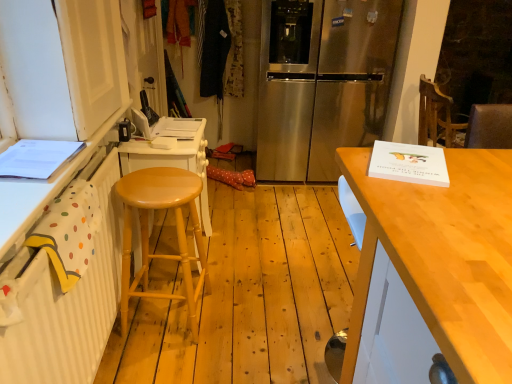
Question: Is light wood table at right to the left or to the right of light wood stool at left in the image?

Choices:
 (A) left
 (B) right

Answer: (B)

Question: Is point click(x=496, y=347) positioned closer to the camera than point click(x=138, y=208)?

Choices:
 (A) farther
 (B) closer

Answer: (B)

Question: Which object is the closest to the light wood stool at left?

Choices:
 (A) light wood table at right
 (B) white painted wood cabinet at left
 (C) stainless steel refrigerator at center

Answer: (B)

Question: Which is farther from the stainless steel refrigerator at center?

Choices:
 (A) light wood table at right
 (B) white painted wood cabinet at left
 (C) light wood stool at left

Answer: (A)